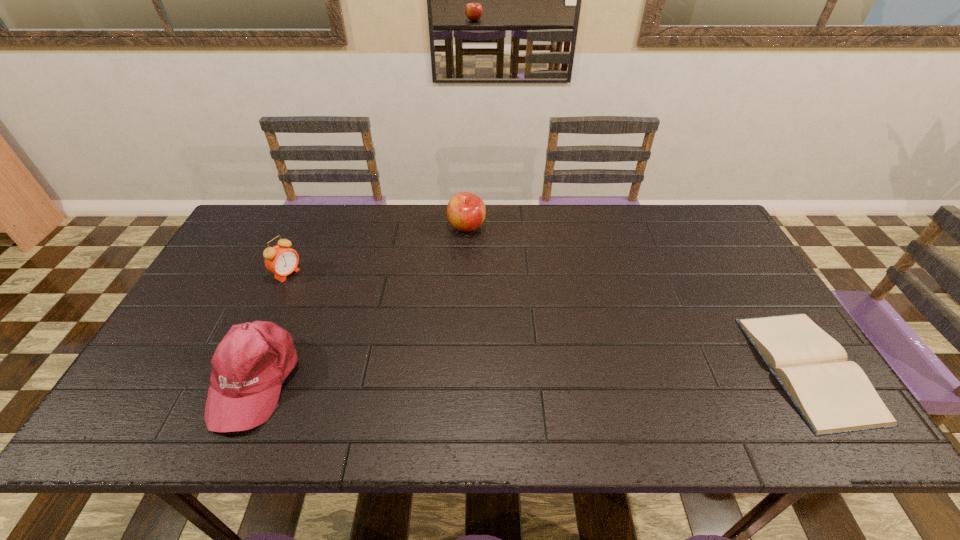
Find the location of a particular element. vacant space at the far edge of the desktop is located at coordinates (595, 210).

In the image, there is a desktop. At what (x,y) coordinates should I click in order to perform the action: click on vacant space at the near edge. Please return your answer as a coordinate pair (x, y). The height and width of the screenshot is (540, 960). Looking at the image, I should click on (615, 372).

Where is `vacant space at the left edge of the desktop`? vacant space at the left edge of the desktop is located at coordinates (214, 299).

Locate an element on the screen. blank space at the right edge is located at coordinates (727, 275).

Where is `vacant space at the near left corner of the desktop`? This screenshot has width=960, height=540. vacant space at the near left corner of the desktop is located at coordinates (169, 381).

Locate an element on the screen. This screenshot has width=960, height=540. free space at the far right corner of the desktop is located at coordinates (692, 244).

This screenshot has height=540, width=960. What are the coordinates of `free space that is in between the shortest object and the second farthest object` in the screenshot? It's located at pos(548,321).

Where is `vacant area between the apple and the alarm clock`? vacant area between the apple and the alarm clock is located at coordinates (377, 250).

This screenshot has height=540, width=960. In order to click on empty space that is in between the third object from left to right and the rightmost object in this screenshot , I will do `click(637, 298)`.

I want to click on free spot between the shortest object and the baseball cap, so click(532, 373).